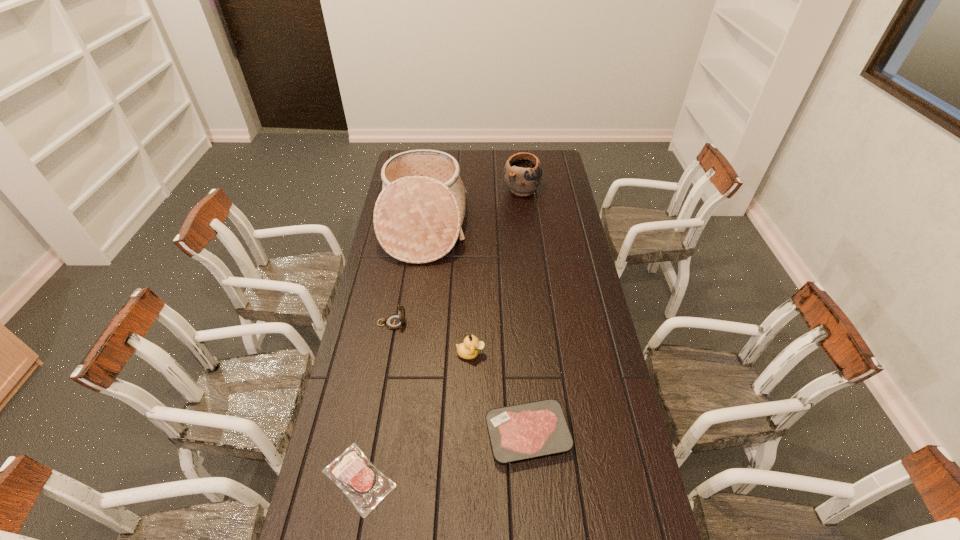
The image size is (960, 540). Identify the location of vacant space at the right edge of the desktop. (605, 332).

This screenshot has height=540, width=960. In order to click on unoccupied position between the shortest object and the duckling in this screenshot , I will do `click(415, 416)`.

Where is `free spot between the duckling and the fifth shortest object`? The image size is (960, 540). free spot between the duckling and the fifth shortest object is located at coordinates (496, 272).

Find the location of a particular element. This screenshot has width=960, height=540. vacant area between the fifth shortest object and the shorter steak is located at coordinates (441, 334).

At what (x,y) coordinates should I click in order to perform the action: click on free space between the second shortest object and the basket. Please return your answer as a coordinate pair (x, y). The image size is (960, 540). Looking at the image, I should click on (476, 330).

Where is `free spot between the third farthest object and the basket`? The height and width of the screenshot is (540, 960). free spot between the third farthest object and the basket is located at coordinates (408, 274).

You are a GUI agent. You are given a task and a screenshot of the screen. Output one action in this format:
    pyautogui.click(x=<x>, y=<y>)
    Task: Click on the vacant point located between the duckling and the left steak
    
    Given the screenshot: What is the action you would take?
    pyautogui.click(x=415, y=416)

I want to click on empty space that is in between the fifth shortest object and the basket, so point(472,207).

The image size is (960, 540). What are the coordinates of `free point between the shortest object and the third nearest object` in the screenshot? It's located at (415, 416).

This screenshot has width=960, height=540. What are the coordinates of `unoccupied position between the third farthest object and the taller steak` in the screenshot? It's located at (460, 379).